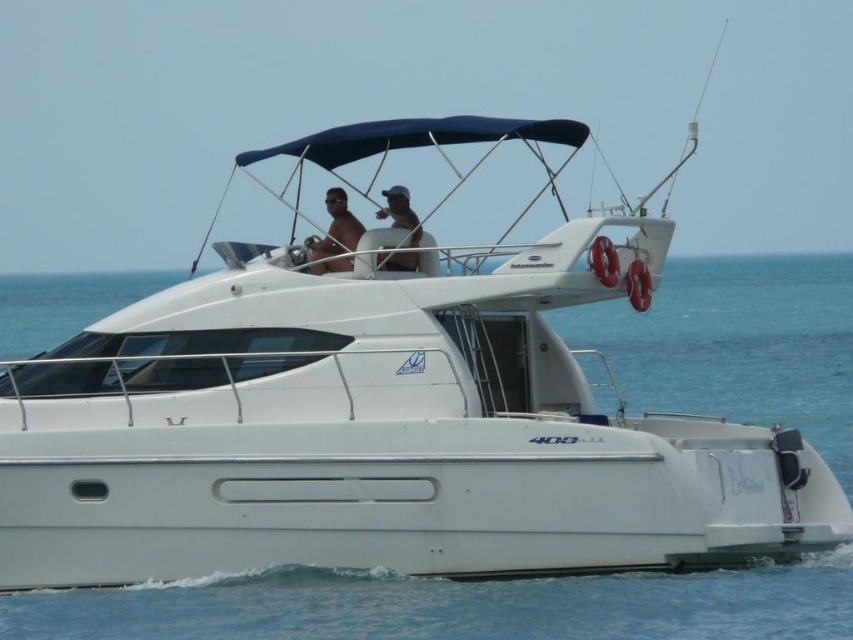
Question: Among these objects, which one is nearest to the camera?

Choices:
 (A) matte white cap at upper center
 (B) matte white shirt at upper center

Answer: (A)

Question: Does matte white shirt at upper center have a smaller size compared to matte white cap at upper center?

Choices:
 (A) no
 (B) yes

Answer: (B)

Question: Is matte white shirt at upper center wider than matte white cap at upper center?

Choices:
 (A) no
 (B) yes

Answer: (B)

Question: Among these points, which one is farthest from the camera?

Choices:
 (A) (397, 227)
 (B) (363, 227)

Answer: (A)

Question: Among these objects, which one is farthest from the camera?

Choices:
 (A) matte white shirt at upper center
 (B) matte white cap at upper center

Answer: (A)

Question: Can you confirm if matte white shirt at upper center is positioned to the left of matte white cap at upper center?

Choices:
 (A) no
 (B) yes

Answer: (B)